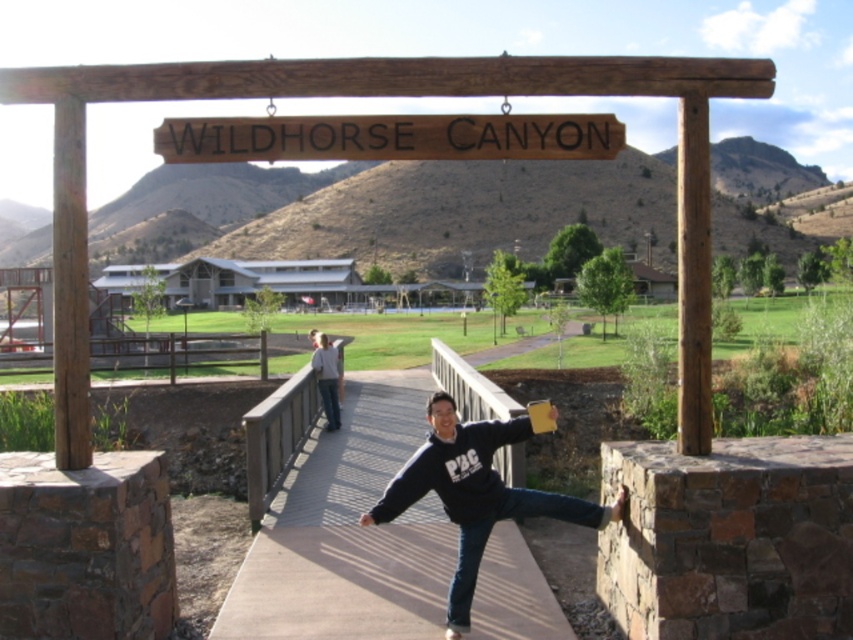
You are standing at the entrance of Wildhorse Canyon and see both the black fleece at center and the light gray sweater at center lying on the ground. If you want to place both items into a rectangular storage box that can only fit items up to the width of the wider of the two, which item determines the minimum required width of the box?

The black fleece at center has a larger width than the light gray sweater at center, so the minimum required width of the box must be at least the width of the black fleece at center to accommodate both items.

You are standing at the entrance of Wildhorse Canyon and see the brown wooden sign at center and the light gray sweater at center. Which object is higher up from the ground?

The brown wooden sign at center is above the light gray sweater at center, so it is higher up from the ground.